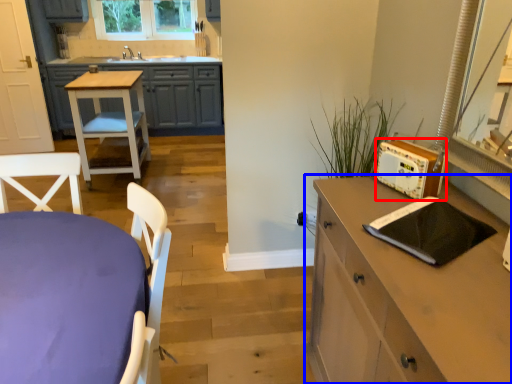
Question: Which of the following is the closest to the observer, appliance (highlighted by a red box) or chest of drawers (highlighted by a blue box)?

Choices:
 (A) appliance
 (B) chest of drawers

Answer: (B)